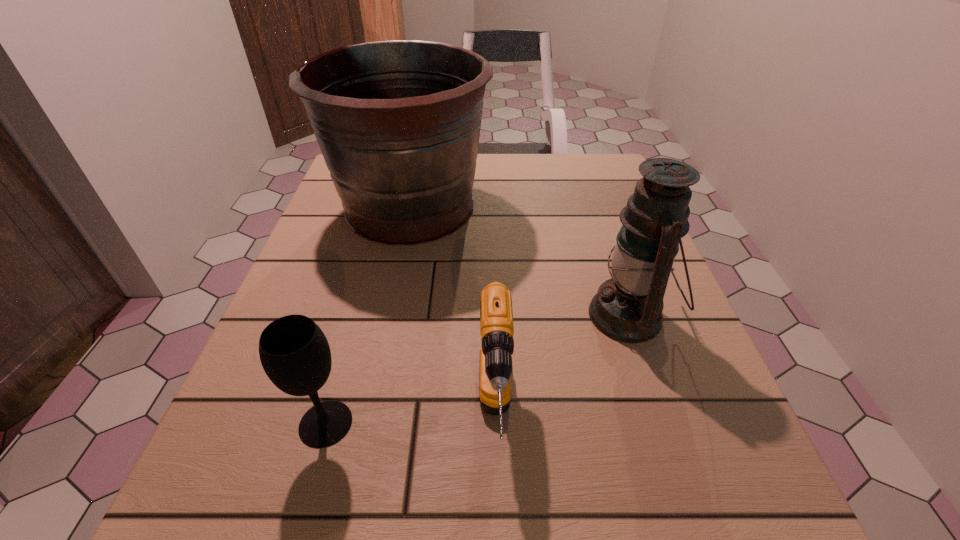
Locate an element on the screen. This screenshot has width=960, height=540. bucket is located at coordinates (398, 122).

Identify the location of the rightmost object. (628, 307).

Locate an element on the screen. Image resolution: width=960 pixels, height=540 pixels. wineglass is located at coordinates (294, 352).

Locate an element on the screen. The height and width of the screenshot is (540, 960). drill is located at coordinates (496, 315).

You are a GUI agent. You are given a task and a screenshot of the screen. Output one action in this format:
    pyautogui.click(x=<x>, y=<y>)
    Task: Click on the vacant region located 0.210m on the front of the farthest object
    This screenshot has height=540, width=960.
    Given the screenshot: What is the action you would take?
    pyautogui.click(x=382, y=335)

Identify the location of free space located on the back of the rightmost object. (582, 177).

Where is `vacant space located 0.330m on the right of the wineglass`? vacant space located 0.330m on the right of the wineglass is located at coordinates (582, 423).

Locate an element on the screen. The width and height of the screenshot is (960, 540). object located in the far edge section of the desktop is located at coordinates (398, 122).

Find the location of a particular element. This screenshot has height=540, width=960. object present at the near edge is located at coordinates (496, 315).

You are a GUI agent. You are given a task and a screenshot of the screen. Output one action in this format:
    pyautogui.click(x=<x>, y=<y>)
    Task: Click on the bucket located in the left edge section of the desktop
    This screenshot has width=960, height=540.
    Given the screenshot: What is the action you would take?
    pyautogui.click(x=398, y=122)